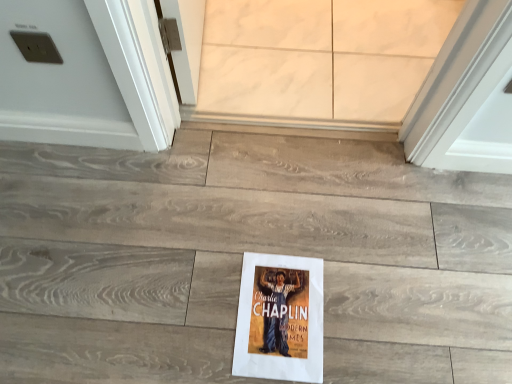
Identify the location of white paper flyer at center. This screenshot has height=384, width=512. (280, 318).

The width and height of the screenshot is (512, 384). What do you see at coordinates (280, 318) in the screenshot? I see `white paper flyer at center` at bounding box center [280, 318].

Where is `white paper flyer at center`? The width and height of the screenshot is (512, 384). white paper flyer at center is located at coordinates (280, 318).